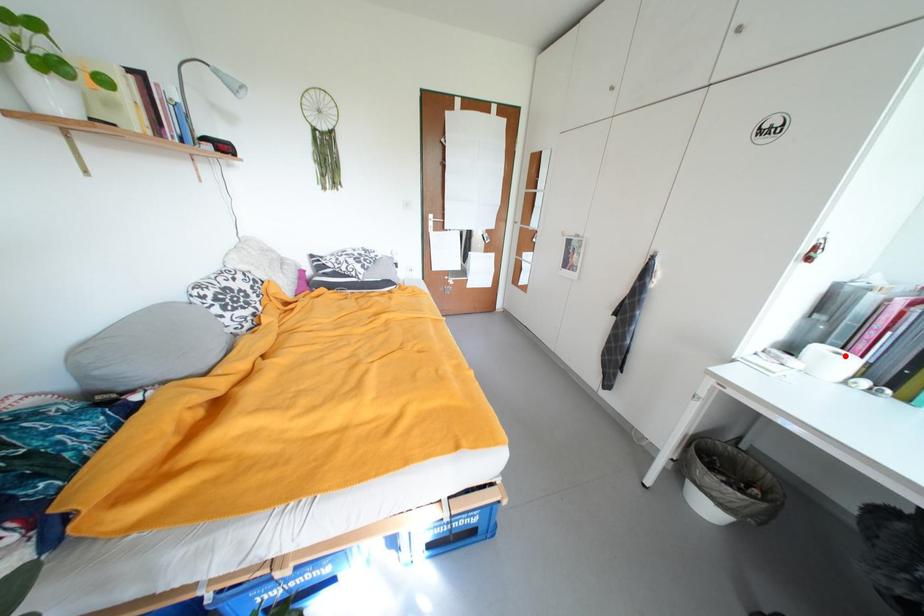
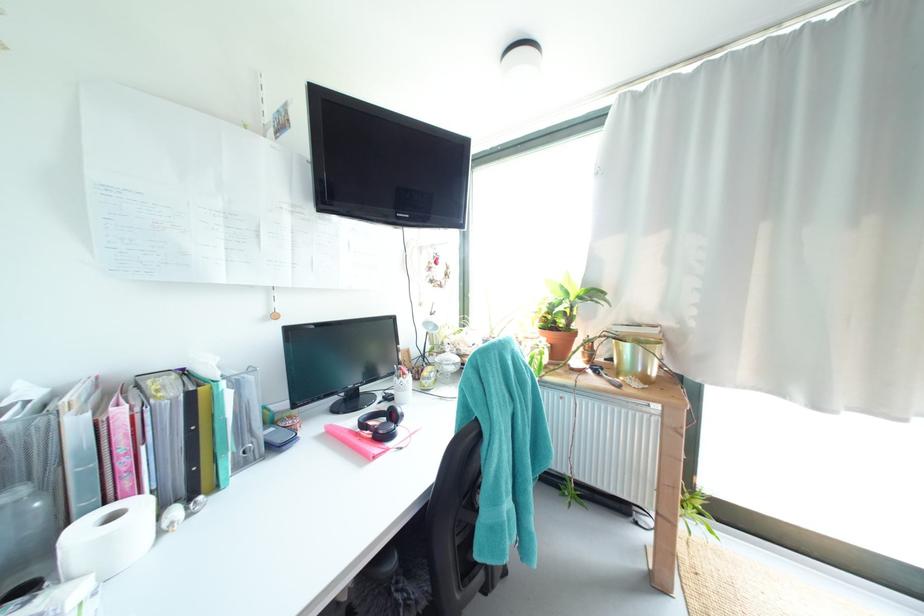
Where in the second image is the point corresponding to the highlighted location from the first image?

(120, 517)